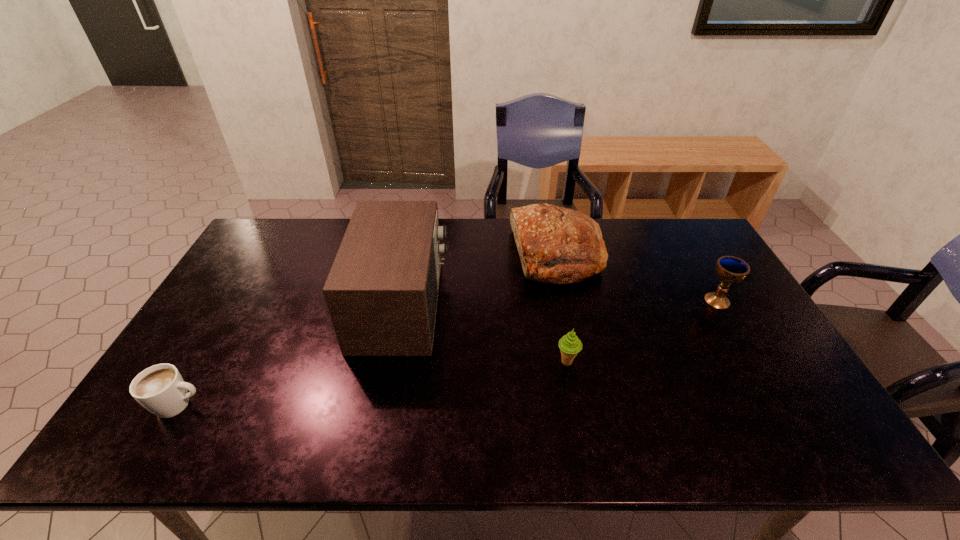
Where is `vacant region that satisfies the following two spatial constraints: 1. on the front side of the icecream; 2. with the handle on the side of the leftmost object`? The height and width of the screenshot is (540, 960). vacant region that satisfies the following two spatial constraints: 1. on the front side of the icecream; 2. with the handle on the side of the leftmost object is located at coordinates (575, 405).